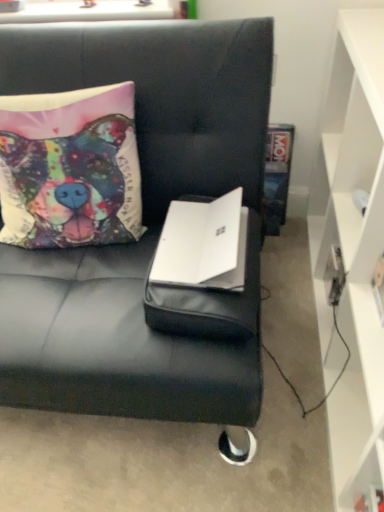
What do you see at coordinates (203, 244) in the screenshot? The image size is (384, 512). I see `white matte laptop at center` at bounding box center [203, 244].

Where is `black leather couch at center`? The width and height of the screenshot is (384, 512). black leather couch at center is located at coordinates (145, 224).

Is white matte laptop at center further to the viewer compared to white matte cabinet at right?

Yes, it is.

What's the angular difference between white matte laptop at center and white matte cabinet at right's facing directions?

The facing directions of white matte laptop at center and white matte cabinet at right are 90.5 degrees apart.

Can you confirm if white matte laptop at center is bigger than white matte cabinet at right?

Incorrect, white matte laptop at center is not larger than white matte cabinet at right.

From a real-world perspective, is white matte laptop at center located beneath white matte cabinet at right?

No, from a real-world perspective, white matte laptop at center is not below white matte cabinet at right.

Which is more to the left, white matte cabinet at right or white matte laptop at center?

white matte laptop at center is more to the left.

From the image's perspective, between white matte cabinet at right and white matte laptop at center, who is located below?

white matte cabinet at right.

Looking at the image, does white matte cabinet at right seem bigger or smaller compared to white matte laptop at center?

Clearly, white matte cabinet at right is larger in size than white matte laptop at center.

How much distance is there between white matte cabinet at right and white matte laptop at center?

The distance of white matte cabinet at right from white matte laptop at center is 15.13 inches.

Between point (42, 214) and point (256, 241), which one is positioned in front?

The point (256, 241) is more forward.

Which object is closer to the camera taking this photo, multicolored fabric pillow at upper left or black leather couch at center?

black leather couch at center.

Would you say multicolored fabric pillow at upper left is inside or outside black leather couch at center?

multicolored fabric pillow at upper left exists entirely within black leather couch at center.

Is multicolored fabric pillow at upper left at the right side of black leather couch at center?

Incorrect, multicolored fabric pillow at upper left is not on the right side of black leather couch at center.

Is black leather couch at center at the back of white matte cabinet at right?

Absolutely, white matte cabinet at right is directed away from black leather couch at center.

Which object is further away from the camera taking this photo, white matte cabinet at right or black leather couch at center?

Positioned behind is black leather couch at center.

Considering the positions of points (338, 366) and (204, 105), is point (338, 366) farther from camera compared to point (204, 105)?

Yes, it is behind point (204, 105).

Looking at their sizes, would you say white matte cabinet at right is wider or thinner than black leather couch at center?

Considering their sizes, white matte cabinet at right looks slimmer than black leather couch at center.

Can you confirm if white matte laptop at center is shorter than black leather couch at center?

Yes.

Who is smaller, white matte laptop at center or black leather couch at center?

With smaller size is white matte laptop at center.

Based on the photo, from the image's perspective, which object appears higher, white matte laptop at center or black leather couch at center?

black leather couch at center.

From the image's perspective, which one is positioned lower, white matte cabinet at right or multicolored fabric pillow at upper left?

white matte cabinet at right appears lower in the image.

Is point (383, 42) closer to viewer compared to point (74, 157)?

Yes, it is.

Between white matte cabinet at right and multicolored fabric pillow at upper left, which one has larger width?

Answer: white matte cabinet at right.

Looking at this image, could you tell me if white matte cabinet at right is turned towards multicolored fabric pillow at upper left?

Yes.

Between black leather couch at center and white matte cabinet at right, which one appears on the right side from the viewer's perspective?

Positioned to the right is white matte cabinet at right.

From a real-world perspective, is black leather couch at center located beneath white matte cabinet at right?

No, from a real-world perspective, black leather couch at center is not below white matte cabinet at right.

Considering the relative sizes of black leather couch at center and white matte cabinet at right in the image provided, is black leather couch at center shorter than white matte cabinet at right?

No, black leather couch at center is not shorter than white matte cabinet at right.

What's the angular difference between black leather couch at center and white matte cabinet at right's facing directions?

They differ by 90.8 degrees in their facing directions.

Find the location of `laptop above the white matte cabinet at right (from the image's perspective)`. laptop above the white matte cabinet at right (from the image's perspective) is located at coordinates (203, 244).

This screenshot has width=384, height=512. Find the location of `laptop lying behind the white matte cabinet at right`. laptop lying behind the white matte cabinet at right is located at coordinates (203, 244).

Looking at the image, which one is located further to multicolored fabric pillow at upper left, white matte cabinet at right or white matte laptop at center?

white matte cabinet at right is further to multicolored fabric pillow at upper left.

From the image, which object appears to be farther from white matte laptop at center, multicolored fabric pillow at upper left or white matte cabinet at right?

white matte cabinet at right is further to white matte laptop at center.

From the image, which object appears to be farther from black leather couch at center, multicolored fabric pillow at upper left or white matte cabinet at right?

The object further to black leather couch at center is white matte cabinet at right.

Estimate the real-world distances between objects in this image. Which object is further from black leather couch at center, white matte laptop at center or white matte cabinet at right?

Based on the image, white matte cabinet at right appears to be further to black leather couch at center.

Which object lies further to the anchor point black leather couch at center, white matte cabinet at right or white matte laptop at center?

Based on the image, white matte cabinet at right appears to be further to black leather couch at center.

Based on their spatial positions, is white matte cabinet at right or multicolored fabric pillow at upper left further from white matte laptop at center?

The object further to white matte laptop at center is white matte cabinet at right.

Based on their spatial positions, is multicolored fabric pillow at upper left or white matte laptop at center further from black leather couch at center?

white matte laptop at center is positioned further to the anchor black leather couch at center.

Based on their spatial positions, is white matte cabinet at right or multicolored fabric pillow at upper left closer to black leather couch at center?

multicolored fabric pillow at upper left.

Where is `studio couch between multicolored fabric pillow at upper left and white matte laptop at center`? This screenshot has width=384, height=512. studio couch between multicolored fabric pillow at upper left and white matte laptop at center is located at coordinates (145, 224).

Where is `studio couch located between multicolored fabric pillow at upper left and white matte cabinet at right in the left-right direction`? studio couch located between multicolored fabric pillow at upper left and white matte cabinet at right in the left-right direction is located at coordinates (145, 224).

You are a GUI agent. You are given a task and a screenshot of the screen. Output one action in this format:
    pyautogui.click(x=<x>, y=<y>)
    Task: Click on the laptop situated between multicolored fabric pillow at upper left and white matte cabinet at right from left to right
    
    Given the screenshot: What is the action you would take?
    pyautogui.click(x=203, y=244)

The width and height of the screenshot is (384, 512). In order to click on laptop between black leather couch at center and white matte cabinet at right in this screenshot , I will do `click(203, 244)`.